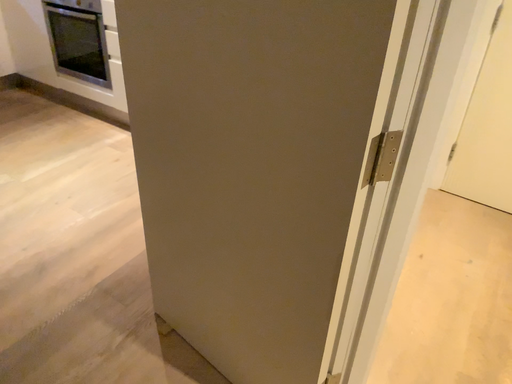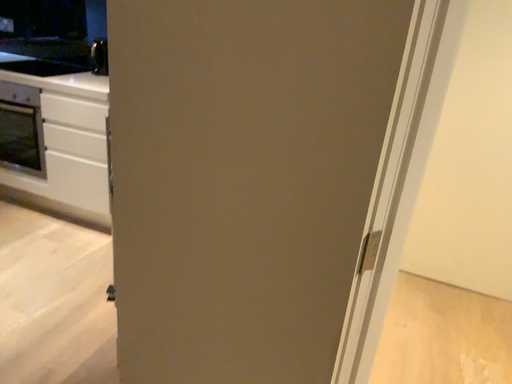
Question: How did the camera likely rotate when shooting the video?

Choices:
 (A) rotated left
 (B) rotated right

Answer: (B)